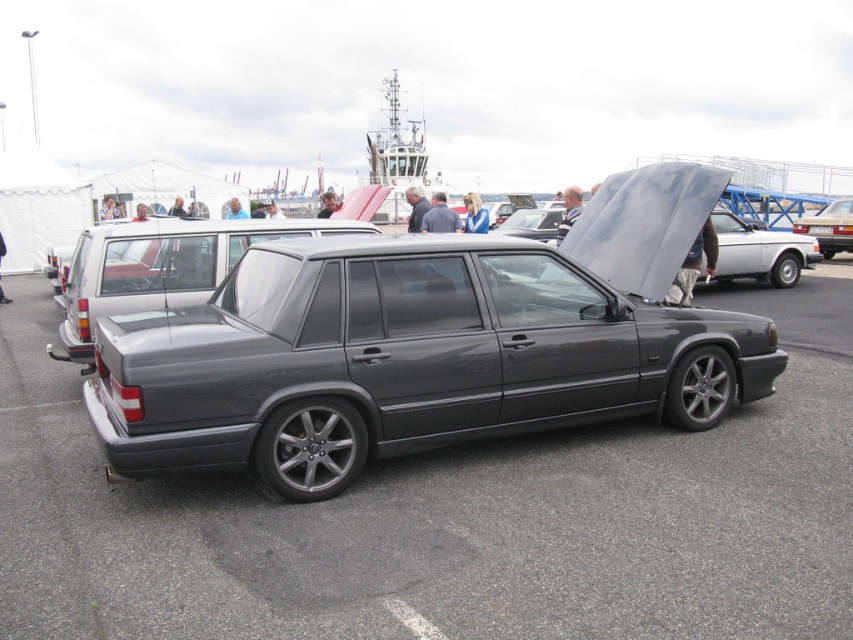
You are a photographer standing at the event and want to take a photo of the matte gray minivan at center. The camera you are using has a focal length of 50mm. Considering the distance between you and the vehicle, is this focal length suitable for capturing the entire vehicle in one frame?

The matte gray minivan at center is 6.45 meters from viewer. A 50mm focal length is generally suitable for capturing a vehicle at that distance, as it provides a field of view wide enough to include the entire minivan in the frame without distortion.

You are a parking attendant at the car show and need to park a new vehicle that is 2 meters wide. The available parking spots are between the matte gray minivan at center and the matte black sedan at center. Can the new vehicle fit in the space between them?

The matte gray minivan at center is wider than the matte black sedan at center, so the space between them may vary. However, without knowing the exact distance between the vehicles, it is impossible to determine if the 2 meter wide vehicle can fit.

You are a photographer at the car show and want to capture both the satin black car at center and the matte gray minivan at center in a single shot. Based on their positions, which car should you focus on first to ensure both are in frame?

The satin black car at center is located below the matte gray minivan at center, so you should focus on the matte gray minivan at center first to ensure both are in frame.